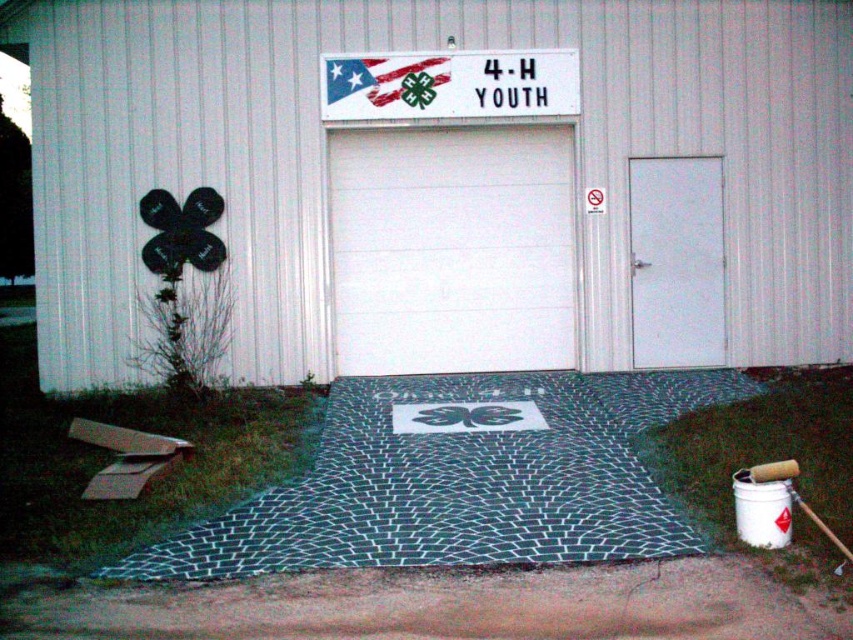
Question: Does black woven mat at center appear on the left side of white paper sign at upper center?

Choices:
 (A) yes
 (B) no

Answer: (B)

Question: Among these objects, which one is nearest to the camera?

Choices:
 (A) black woven mat at center
 (B) white matte door at right
 (C) white matte garage door at center
 (D) white paper sign at upper center

Answer: (A)

Question: Which is nearer to the white smooth garage door at center?

Choices:
 (A) black woven mat at center
 (B) white matte garage door at center
 (C) white matte door at right
 (D) white paper sign at upper center

Answer: (D)

Question: Which point appears farthest from the camera in this image?

Choices:
 (A) (300, 518)
 (B) (416, 228)
 (C) (706, 356)
 (D) (451, 51)

Answer: (B)

Question: Where is white smooth garage door at center located in relation to white paper sign at upper center in the image?

Choices:
 (A) right
 (B) left

Answer: (A)

Question: Is black woven mat at center bigger than white smooth garage door at center?

Choices:
 (A) yes
 (B) no

Answer: (B)